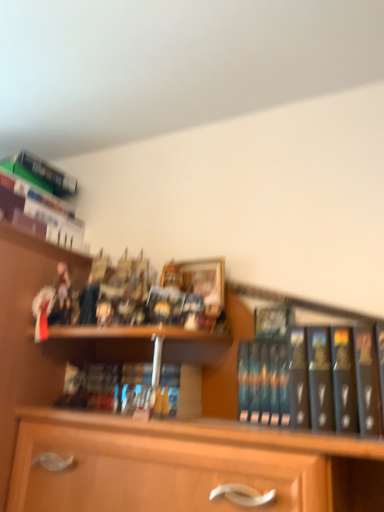
Question: Does black matte book at right, the third book from the left, appear on the left side of hardcover book at upper left, which is counted as the third book, starting from the front?

Choices:
 (A) yes
 (B) no

Answer: (B)

Question: Does black matte book at right, placed as the first book when sorted from right to left, lie in front of hardcover book at upper left, positioned as the 1th book in back-to-front order?

Choices:
 (A) yes
 (B) no

Answer: (A)

Question: Can you confirm if black matte book at right, the second book positioned from the top, is shorter than hardcover book at upper left, which is counted as the first book, starting from the top?

Choices:
 (A) no
 (B) yes

Answer: (B)

Question: Is black matte book at right, the third book from the left, outside hardcover book at upper left, the third book ordered from the bottom?

Choices:
 (A) yes
 (B) no

Answer: (A)

Question: From a real-world perspective, is black matte book at right, placed as the first book when sorted from right to left, located higher than hardcover book at upper left, the third book ordered from the bottom?

Choices:
 (A) no
 (B) yes

Answer: (A)

Question: Are black matte book at right, which is the 2th book from bottom to top, and hardcover book at upper left, which is counted as the first book, starting from the top, making contact?

Choices:
 (A) yes
 (B) no

Answer: (B)

Question: Considering the relative sizes of hardcover books at center, the second book in the front-to-back sequence, and black matte book at right, the 1th book when ordered from front to back, in the image provided, is hardcover books at center, the second book in the front-to-back sequence, bigger than black matte book at right, the 1th book when ordered from front to back,?

Choices:
 (A) no
 (B) yes

Answer: (B)

Question: Is hardcover books at center, positioned as the 1th book in bottom-to-top order, looking in the opposite direction of black matte book at right, the 3th book in the back-to-front sequence?

Choices:
 (A) yes
 (B) no

Answer: (B)

Question: Can you confirm if hardcover books at center, positioned as the 1th book in bottom-to-top order, is wider than black matte book at right, the third book from the left?

Choices:
 (A) yes
 (B) no

Answer: (A)

Question: Is hardcover books at center, the second book in the front-to-back sequence, facing towards black matte book at right, which is the 2th book from bottom to top?

Choices:
 (A) yes
 (B) no

Answer: (B)

Question: Is the position of hardcover books at center, the second book from the left, less distant than that of black matte book at right, the third book from the left?

Choices:
 (A) no
 (B) yes

Answer: (A)

Question: Considering the relative sizes of hardcover books at center, which is counted as the second book, starting from the right, and black matte book at right, placed as the first book when sorted from right to left, in the image provided, is hardcover books at center, which is counted as the second book, starting from the right, smaller than black matte book at right, placed as the first book when sorted from right to left,?

Choices:
 (A) no
 (B) yes

Answer: (A)

Question: Is hardcover book at upper left, which is counted as the first book, starting from the top, positioned behind wooden figurines at left?

Choices:
 (A) yes
 (B) no

Answer: (A)